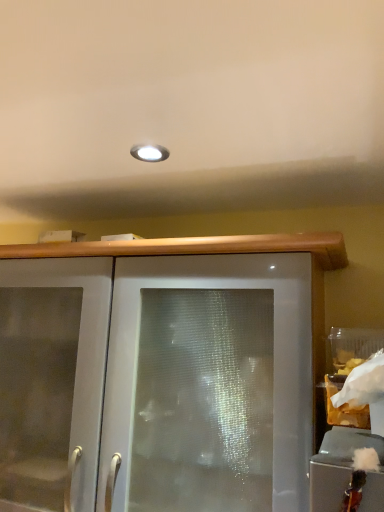
Question: Can you confirm if white paper bag at right is bigger than satin white cabinet at center, which appears as the 1th cabinetry when ordered from the bottom?

Choices:
 (A) no
 (B) yes

Answer: (A)

Question: Can you confirm if white paper bag at right is thinner than satin white cabinet at center, positioned as the first cabinetry in back-to-front order?

Choices:
 (A) yes
 (B) no

Answer: (A)

Question: Is white paper bag at right closer to the viewer compared to satin white cabinet at center, which appears as the 1th cabinetry when ordered from the bottom?

Choices:
 (A) yes
 (B) no

Answer: (A)

Question: Is white paper bag at right facing towards satin white cabinet at center, positioned as the 2th cabinetry in top-to-bottom order?

Choices:
 (A) no
 (B) yes

Answer: (A)

Question: Does white paper bag at right appear on the left side of satin white cabinet at center, positioned as the 2th cabinetry in top-to-bottom order?

Choices:
 (A) yes
 (B) no

Answer: (B)

Question: Is white paper bag at right not near satin white cabinet at center, arranged as the second cabinetry when viewed from the right?

Choices:
 (A) no
 (B) yes

Answer: (A)

Question: Is frosted glass cabinet at lower right, arranged as the 1th cabinetry when viewed from the top, looking in the opposite direction of satin white cabinet at center, arranged as the first cabinetry when viewed from the left?

Choices:
 (A) no
 (B) yes

Answer: (A)

Question: Considering the relative positions of frosted glass cabinet at lower right, which is the first cabinetry in right-to-left order, and satin white cabinet at center, arranged as the second cabinetry when viewed from the right, in the image provided, is frosted glass cabinet at lower right, which is the first cabinetry in right-to-left order, behind satin white cabinet at center, arranged as the second cabinetry when viewed from the right,?

Choices:
 (A) yes
 (B) no

Answer: (B)

Question: Is frosted glass cabinet at lower right, placed as the 2th cabinetry when sorted from left to right, positioned beyond the bounds of satin white cabinet at center, which appears as the 1th cabinetry when ordered from the bottom?

Choices:
 (A) yes
 (B) no

Answer: (A)

Question: Could you tell me if frosted glass cabinet at lower right, the second cabinetry from the bottom, is turned towards satin white cabinet at center, which appears as the 1th cabinetry when ordered from the bottom?

Choices:
 (A) yes
 (B) no

Answer: (B)

Question: Is frosted glass cabinet at lower right, arranged as the 1th cabinetry when viewed from the top, to the left of satin white cabinet at center, positioned as the first cabinetry in back-to-front order, from the viewer's perspective?

Choices:
 (A) no
 (B) yes

Answer: (A)

Question: Considering the relative sizes of frosted glass cabinet at lower right, which is the first cabinetry in right-to-left order, and satin white cabinet at center, positioned as the first cabinetry in back-to-front order, in the image provided, is frosted glass cabinet at lower right, which is the first cabinetry in right-to-left order, shorter than satin white cabinet at center, positioned as the first cabinetry in back-to-front order,?

Choices:
 (A) no
 (B) yes

Answer: (B)

Question: Is frosted glass cabinet at lower right, the second cabinetry from the bottom, outside of white paper bag at right?

Choices:
 (A) yes
 (B) no

Answer: (A)